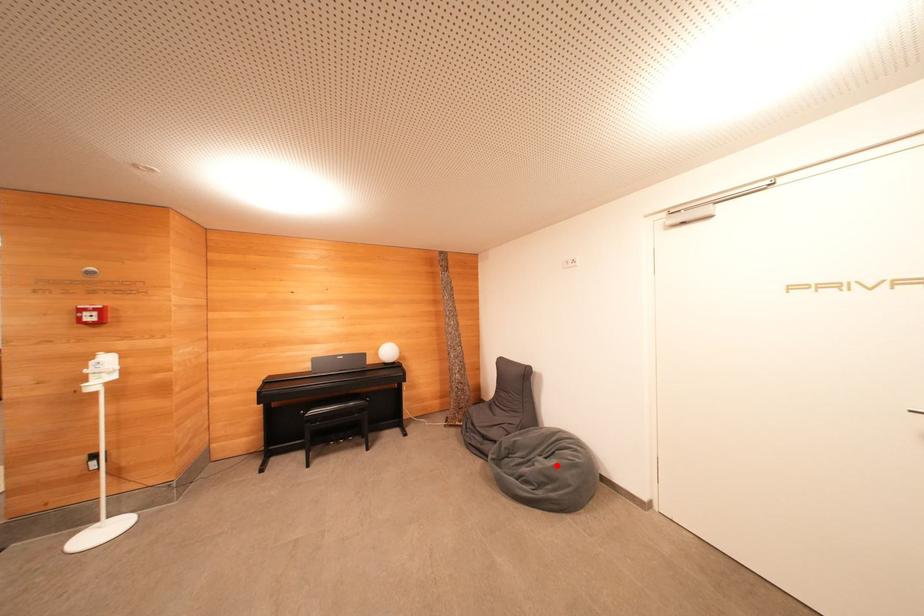
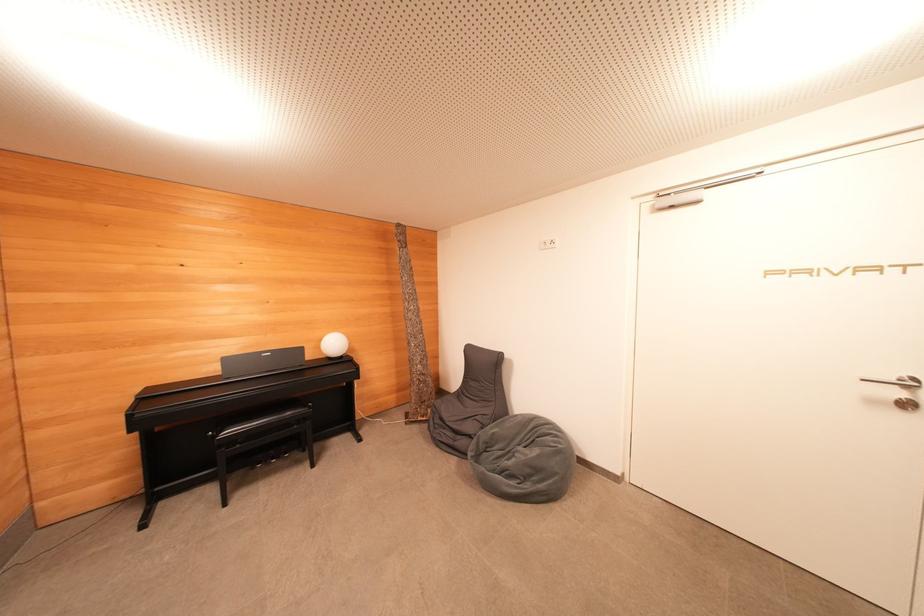
Question: I am providing you with two images of the same scene from different viewpoints. Given a red point in image1, look at the same physical point in image2. Is it:

Choices:
 (A) Closer to the viewpoint
 (B) Farther from the viewpoint

Answer: (B)